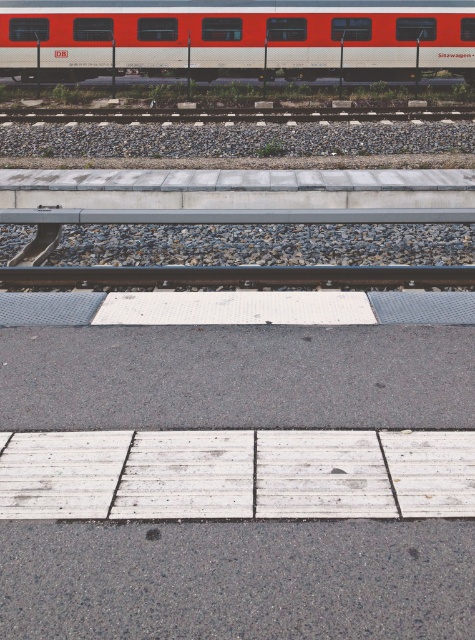
Is red/white passenger train at upper left wider than black rubber train track at center?

Yes, red/white passenger train at upper left is wider than black rubber train track at center.

Is red/white passenger train at upper left to the left of black rubber train track at center from the viewer's perspective?

Incorrect, red/white passenger train at upper left is not on the left side of black rubber train track at center.

Between point (171, 58) and point (391, 278), which one is positioned in front?

Positioned in front is point (391, 278).

Where is `red/white passenger train at upper left`? The width and height of the screenshot is (475, 640). red/white passenger train at upper left is located at coordinates (237, 36).